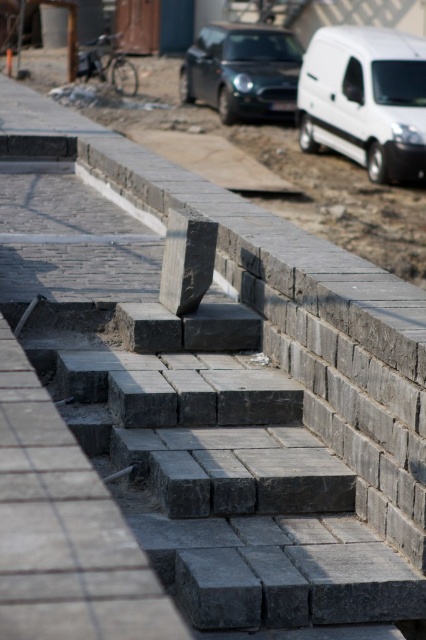
From the picture: You are standing at the base of the steps looking up at the construction site. There are two points marked on the steps. Which point is closer to you, point (348,56) or point (284,104)?

Point (348,56) is closer to you than point (284,104).

You are standing at the bottom of the steps and looking towards the dirt area. There is a point marked at coordinates (365, 99). Which object is located at that point?

The point at coordinates (365, 99) corresponds to the white matte van at upper right.